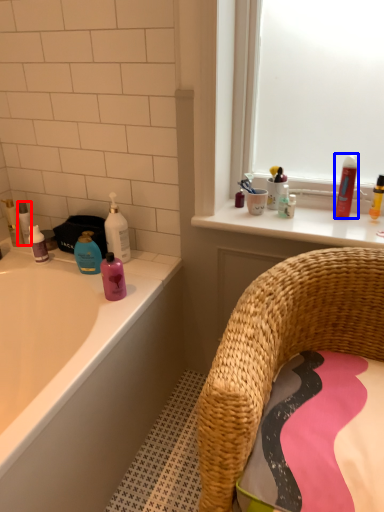
Question: Which point is further to the camera, toiletry (highlighted by a red box) or mouthwash (highlighted by a blue box)?

Choices:
 (A) toiletry
 (B) mouthwash

Answer: (A)